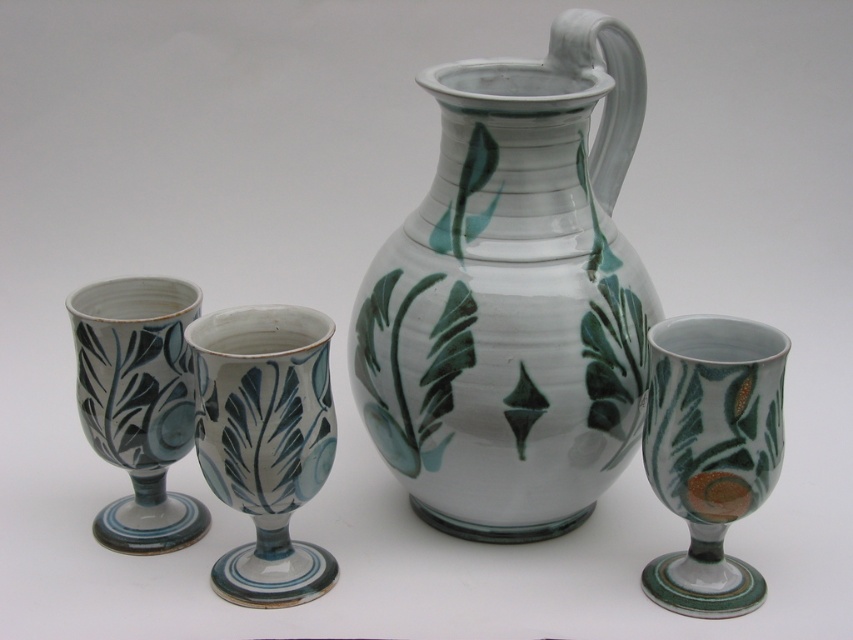
Looking at this image, you are setting up a table for a dinner party and have both the white glossy jug at center and the matte ceramic goblet at left. Which item should you choose if you need a larger vessel to hold more liquid?

The white glossy jug at center is larger in size than the matte ceramic goblet at left, so you should choose the white glossy jug at center to hold more liquid.

What is the object located at coordinates point (265, 442)?

The object located at point (265, 442) is the matte ceramic vase at center.